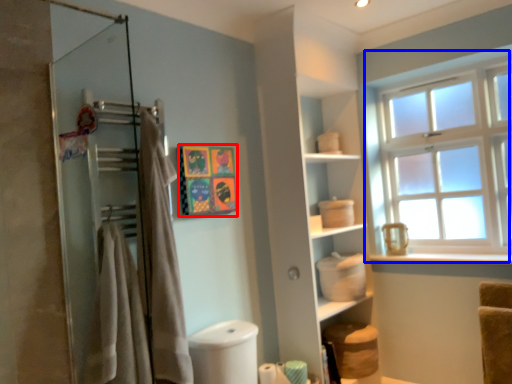
Question: Which of the following is the farthest to the observer, art (highlighted by a red box) or window (highlighted by a blue box)?

Choices:
 (A) art
 (B) window

Answer: (B)